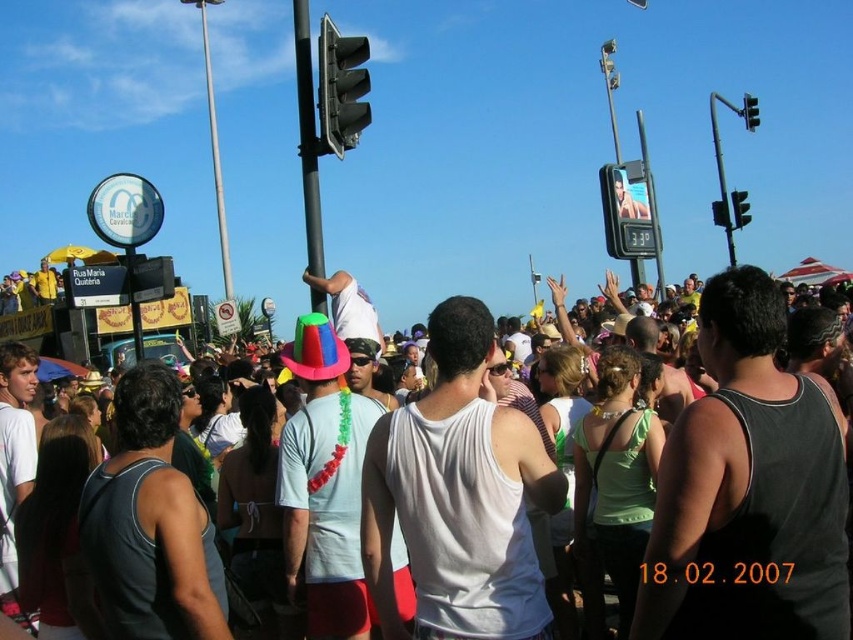
Question: Which of these objects is positioned closest to the white tank top at center?

Choices:
 (A) metallic traffic light at upper center
 (B) black plastic traffic light at upper right

Answer: (A)

Question: Can you confirm if metallic pole at center is smaller than black plastic traffic light at upper right?

Choices:
 (A) no
 (B) yes

Answer: (A)

Question: Can you confirm if white tank top at center is positioned to the right of metallic pole at center?

Choices:
 (A) no
 (B) yes

Answer: (B)

Question: Which object is positioned closest to the black plastic traffic light at upper right?

Choices:
 (A) metallic gray traffic light at upper center
 (B) metallic traffic light at upper right
 (C) metallic pole at center
 (D) white tank top at center

Answer: (B)

Question: Is metallic gray traffic light at upper center below metallic traffic light at upper right?

Choices:
 (A) yes
 (B) no

Answer: (A)

Question: Which is nearer to the black plastic traffic light at upper right?

Choices:
 (A) metallic gray traffic light at upper center
 (B) white tank top at center
 (C) metallic pole at center
 (D) metallic traffic light at upper center

Answer: (D)